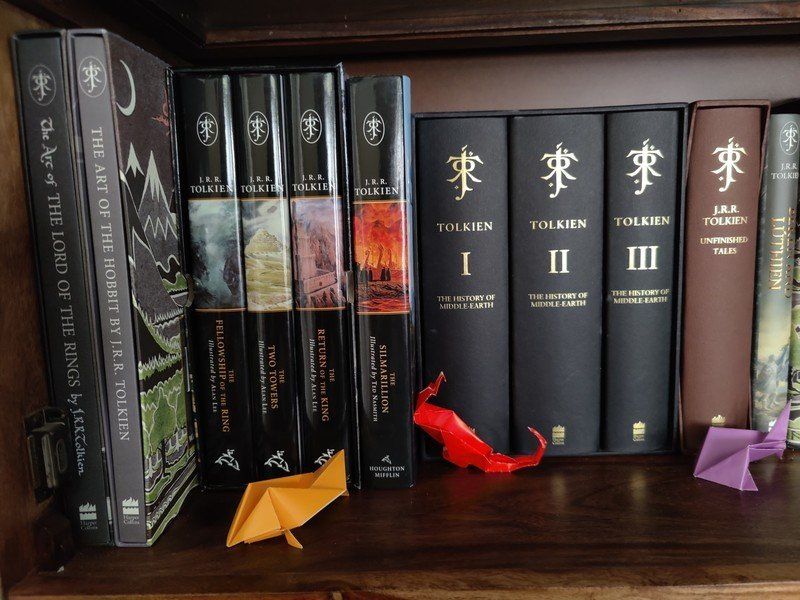
This screenshot has width=800, height=600. I want to click on black spine on books, so click(x=240, y=382), click(x=280, y=389), click(x=340, y=396), click(x=362, y=400).